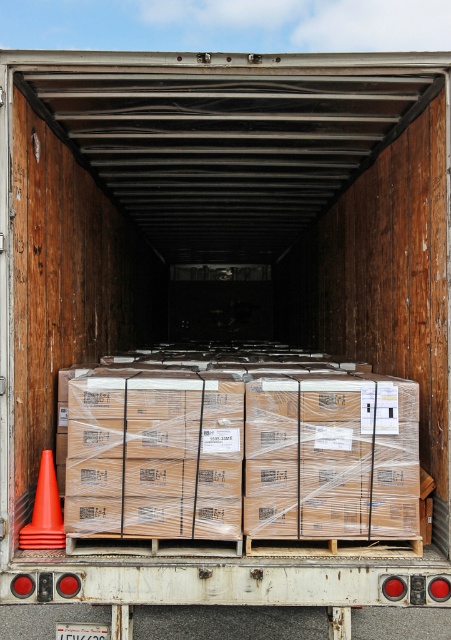
Question: Does brown cardboard boxes at center have a larger size compared to orange matte traffic cone at lower left?

Choices:
 (A) no
 (B) yes

Answer: (B)

Question: Is the position of brown cardboard boxes at center less distant than that of orange matte traffic cone at lower left?

Choices:
 (A) yes
 (B) no

Answer: (A)

Question: Among these objects, which one is farthest from the camera?

Choices:
 (A) brown cardboard boxes at center
 (B) orange matte traffic cone at lower left

Answer: (B)

Question: Which point is closer to the camera taking this photo?

Choices:
 (A) (46, 456)
 (B) (265, 378)

Answer: (B)

Question: Which of the following is the closest to the observer?

Choices:
 (A) brown cardboard boxes at center
 (B) orange matte traffic cone at lower left

Answer: (A)

Question: Is brown cardboard boxes at center below orange matte traffic cone at lower left?

Choices:
 (A) yes
 (B) no

Answer: (B)